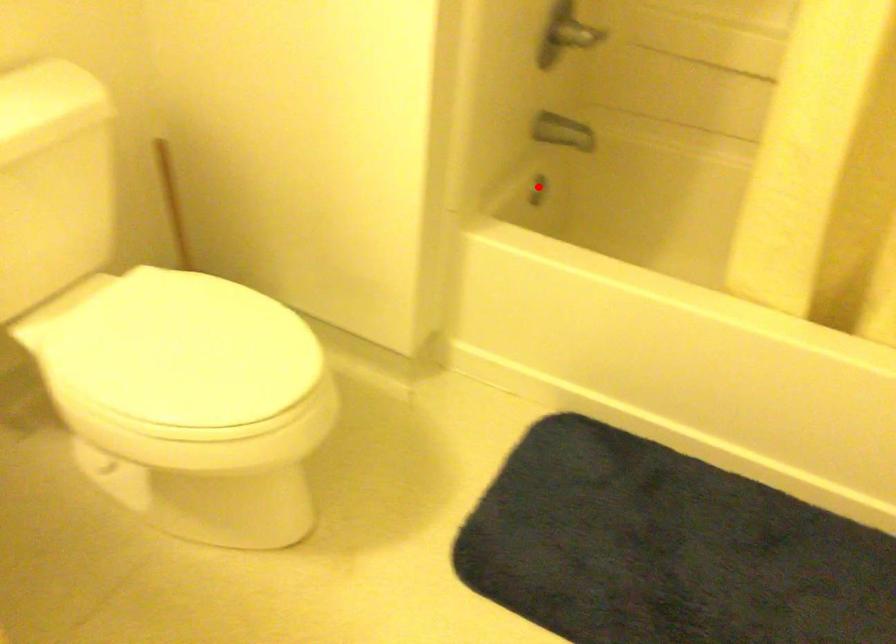
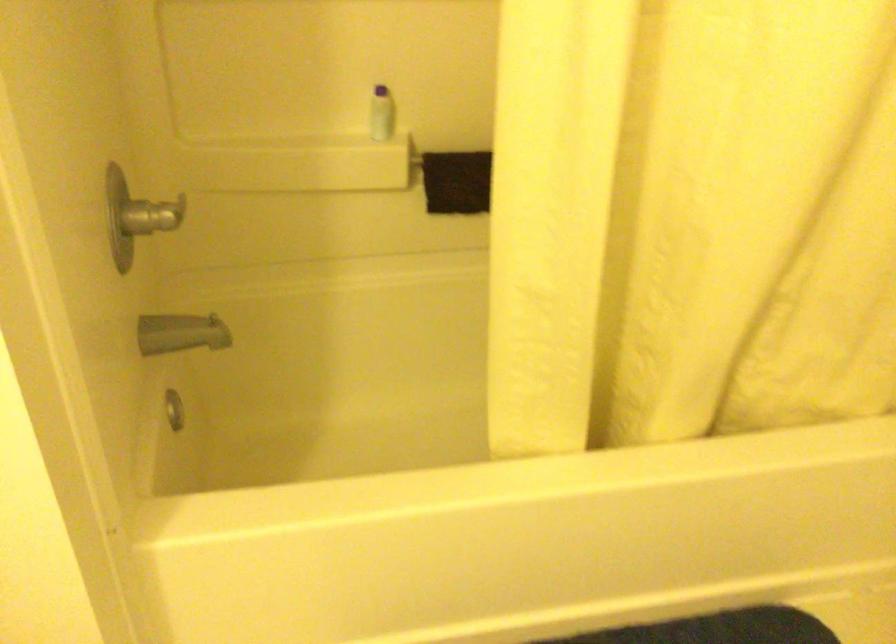
Find the pixel in the second image that matches the highlighted location in the first image.

(174, 410)